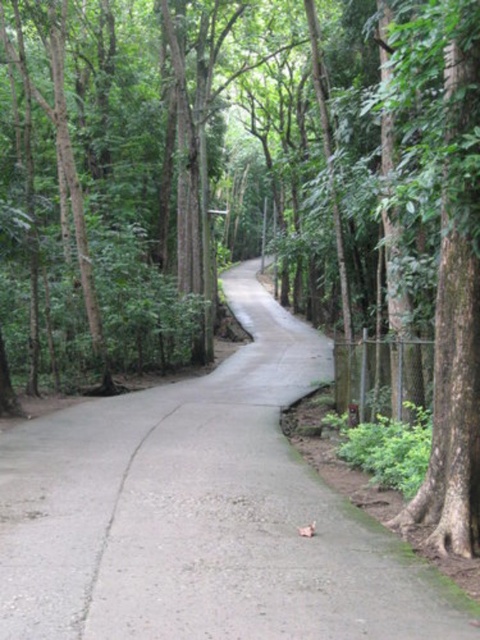
What do you see at coordinates (201, 513) in the screenshot? This screenshot has width=480, height=640. I see `gray concrete pavement at center` at bounding box center [201, 513].

Where is `gray concrete pavement at center`? This screenshot has height=640, width=480. gray concrete pavement at center is located at coordinates (201, 513).